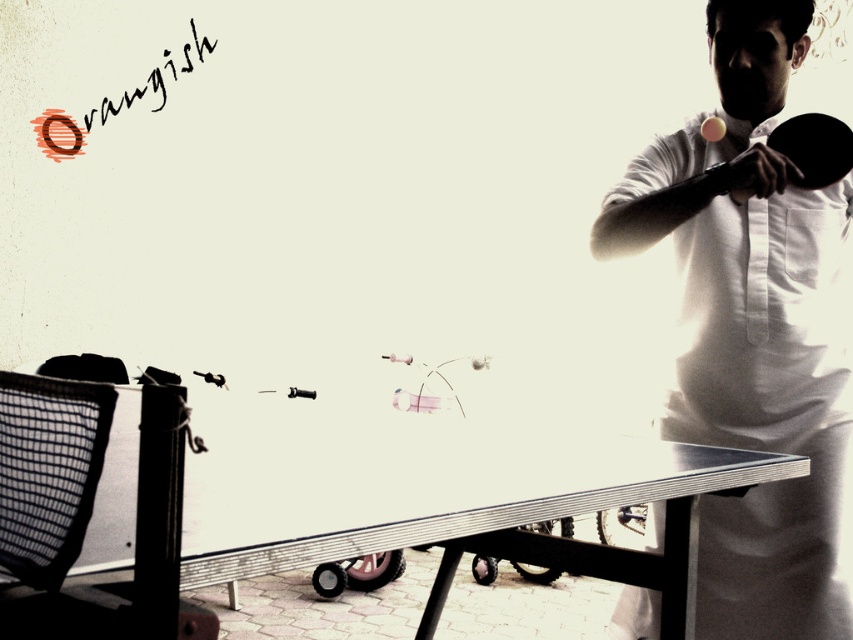
Does white matte ping pong paddle at upper right have a larger size compared to white glossy table tennis table at center?

Yes, white matte ping pong paddle at upper right is bigger than white glossy table tennis table at center.

Measure the distance between white matte ping pong paddle at upper right and camera.

They are 5.21 feet apart.

Locate an element on the screen. This screenshot has height=640, width=853. white matte ping pong paddle at upper right is located at coordinates (753, 333).

Who is positioned more to the left, black rubber paddle at upper right or white glossy table tennis table at center?

white glossy table tennis table at center is more to the left.

Is black rubber paddle at upper right shorter than white glossy table tennis table at center?

No, black rubber paddle at upper right is not shorter than white glossy table tennis table at center.

Does point (807, 125) lie behind point (715, 128)?

That is False.

I want to click on black rubber paddle at upper right, so click(x=814, y=147).

Can you confirm if white matte ping pong paddle at upper right is positioned to the right of black rubber paddle at upper right?

No, white matte ping pong paddle at upper right is not to the right of black rubber paddle at upper right.

I want to click on white matte ping pong paddle at upper right, so click(x=753, y=333).

You are a GUI agent. You are given a task and a screenshot of the screen. Output one action in this format:
    pyautogui.click(x=<x>, y=<y>)
    Task: Click on the white matte ping pong paddle at upper right
    The height and width of the screenshot is (640, 853).
    Given the screenshot: What is the action you would take?
    pyautogui.click(x=753, y=333)